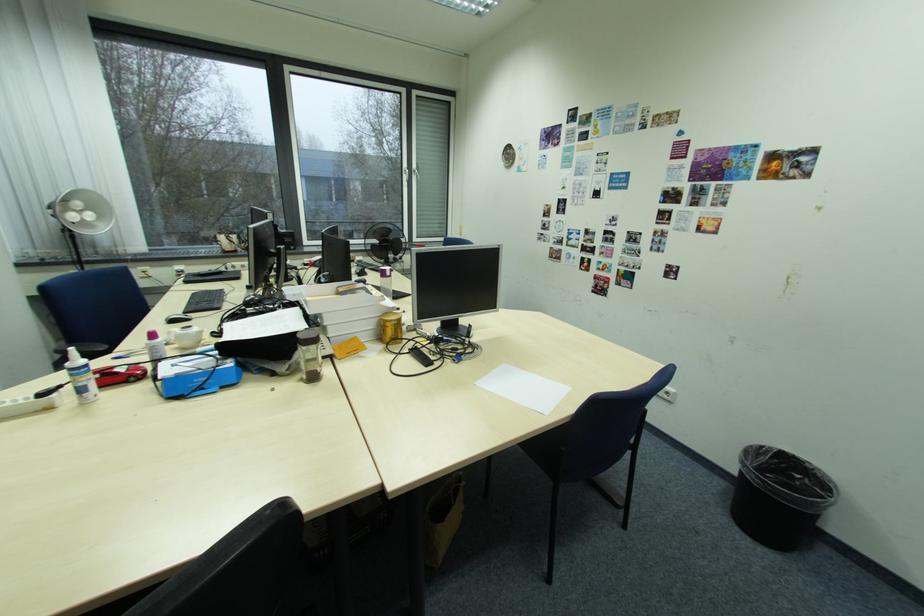
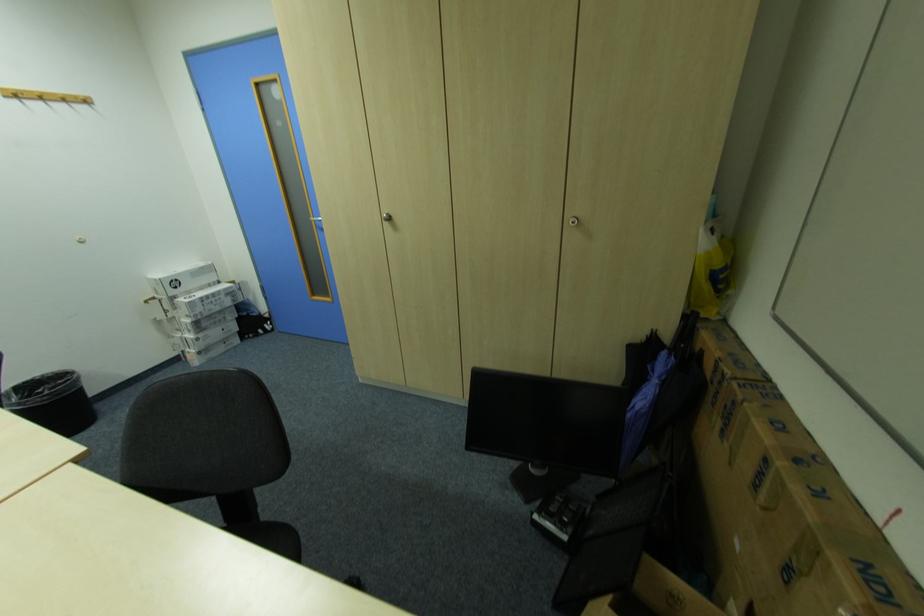
Find the pixel in the second image that matches point 807,477 in the first image.

(49, 391)